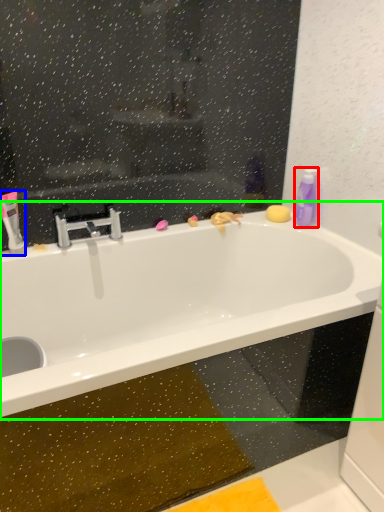
Question: Based on their relative distances, which object is farther from cleaning product (highlighted by a red box)? Choose from mouthwash (highlighted by a blue box) and bathtub (highlighted by a green box).

Choices:
 (A) mouthwash
 (B) bathtub

Answer: (A)